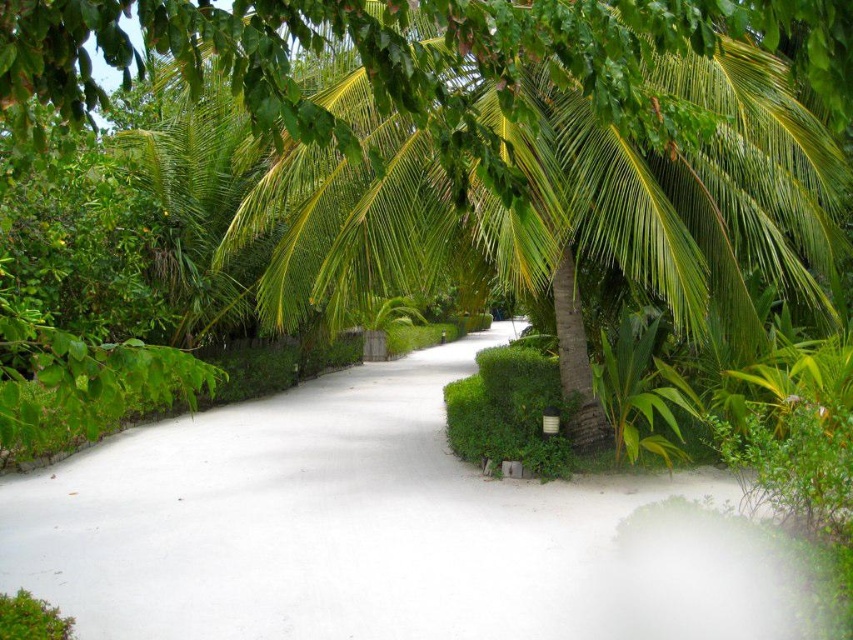
From the picture: Can you confirm if white sand path at center is bigger than green leafy coconut tree at center?

Indeed, white sand path at center has a larger size compared to green leafy coconut tree at center.

Is white sand path at center to the right of green leafy coconut tree at center from the viewer's perspective?

Incorrect, white sand path at center is not on the right side of green leafy coconut tree at center.

What do you see at coordinates (381, 531) in the screenshot? I see `white sand path at center` at bounding box center [381, 531].

Locate an element on the screen. white sand path at center is located at coordinates (381, 531).